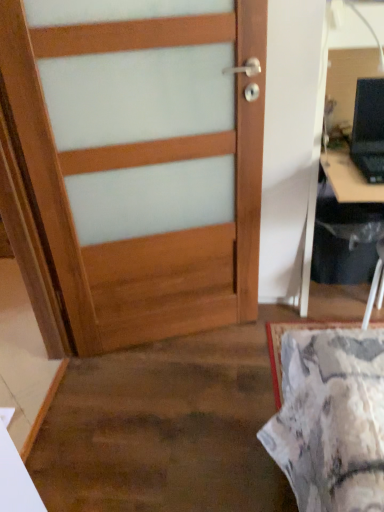
Question: Can you confirm if wooden door at center is wider than black plastic laptop at upper right?

Choices:
 (A) yes
 (B) no

Answer: (B)

Question: Is wooden door at center to the left of black plastic laptop at upper right from the viewer's perspective?

Choices:
 (A) yes
 (B) no

Answer: (A)

Question: Is the surface of wooden door at center in direct contact with black plastic laptop at upper right?

Choices:
 (A) yes
 (B) no

Answer: (B)

Question: Is wooden door at center not inside black plastic laptop at upper right?

Choices:
 (A) yes
 (B) no

Answer: (A)

Question: Considering the relative sizes of wooden door at center and black plastic laptop at upper right in the image provided, is wooden door at center thinner than black plastic laptop at upper right?

Choices:
 (A) no
 (B) yes

Answer: (B)

Question: From the image's perspective, would you say wooden door at center is positioned over black plastic laptop at upper right?

Choices:
 (A) no
 (B) yes

Answer: (A)

Question: Is black plastic laptop at upper right wider than black plastic computer desk at right?

Choices:
 (A) no
 (B) yes

Answer: (A)

Question: Can you confirm if black plastic laptop at upper right is shorter than black plastic computer desk at right?

Choices:
 (A) no
 (B) yes

Answer: (B)

Question: From the image's perspective, would you say black plastic laptop at upper right is shown under black plastic computer desk at right?

Choices:
 (A) yes
 (B) no

Answer: (B)

Question: From the image's perspective, is black plastic laptop at upper right above black plastic computer desk at right?

Choices:
 (A) yes
 (B) no

Answer: (A)

Question: Does black plastic laptop at upper right touch black plastic computer desk at right?

Choices:
 (A) yes
 (B) no

Answer: (B)

Question: Is black plastic laptop at upper right completely or partially outside of black plastic computer desk at right?

Choices:
 (A) yes
 (B) no

Answer: (B)

Question: From the image's perspective, is black plastic computer desk at right on black plastic laptop at upper right?

Choices:
 (A) no
 (B) yes

Answer: (A)